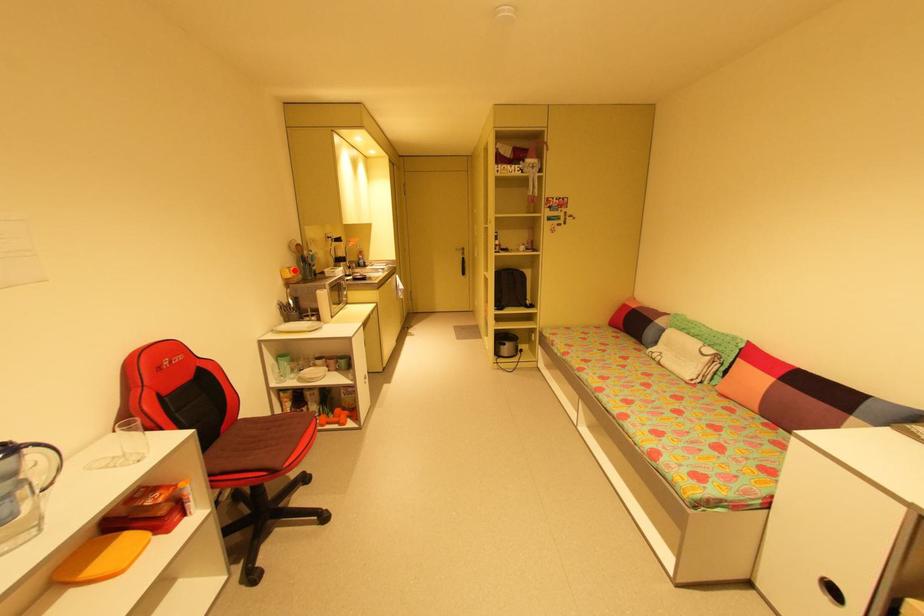
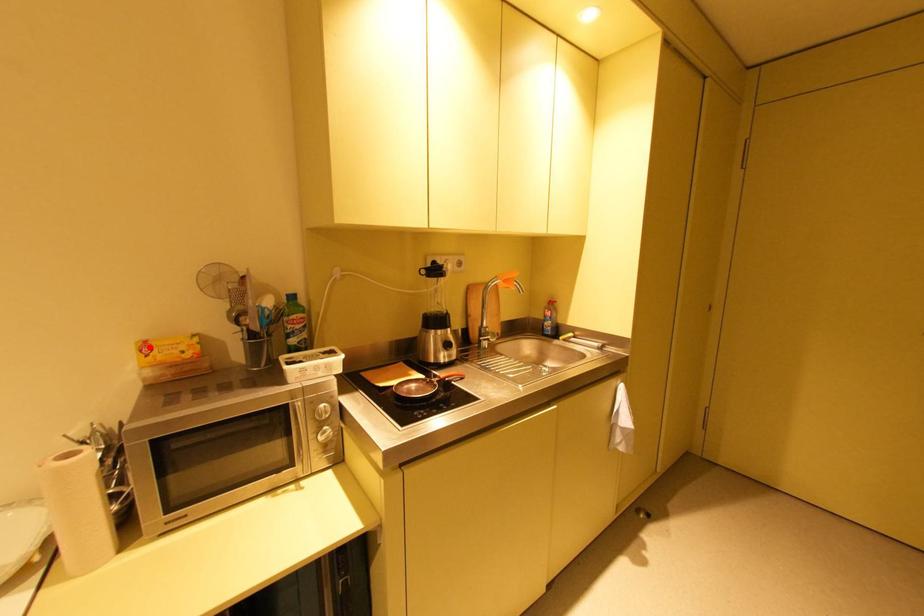
I am providing you with two images of the same scene from different viewpoints. A red point is marked on the first image and another point is marked on the second image. Do the highlighted points in image1 and image2 indicate the same real-world spot?

Yes